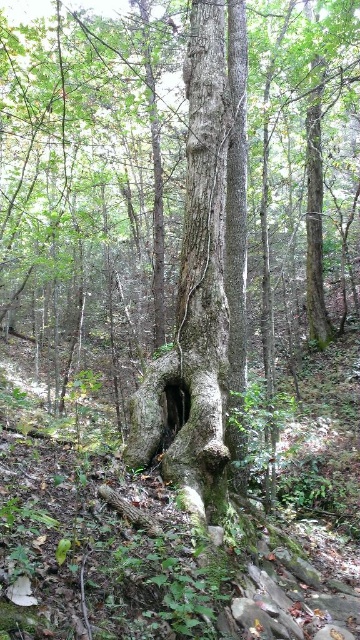
You are a hiker navigating through the forest and want to place markers at two specific points. The first marker is at point (209, 260), and the second is at point (176, 397). If you look towards the direction of the large tree trunk, which marker is closer to you?

Answer: Point (176, 397) is closer to you because it is in front of point (209, 260), which is behind it when facing the large tree trunk.